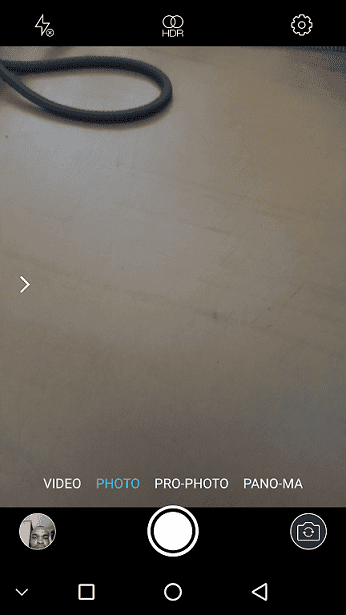
The width and height of the screenshot is (346, 615). I want to click on table, so click(x=236, y=309).